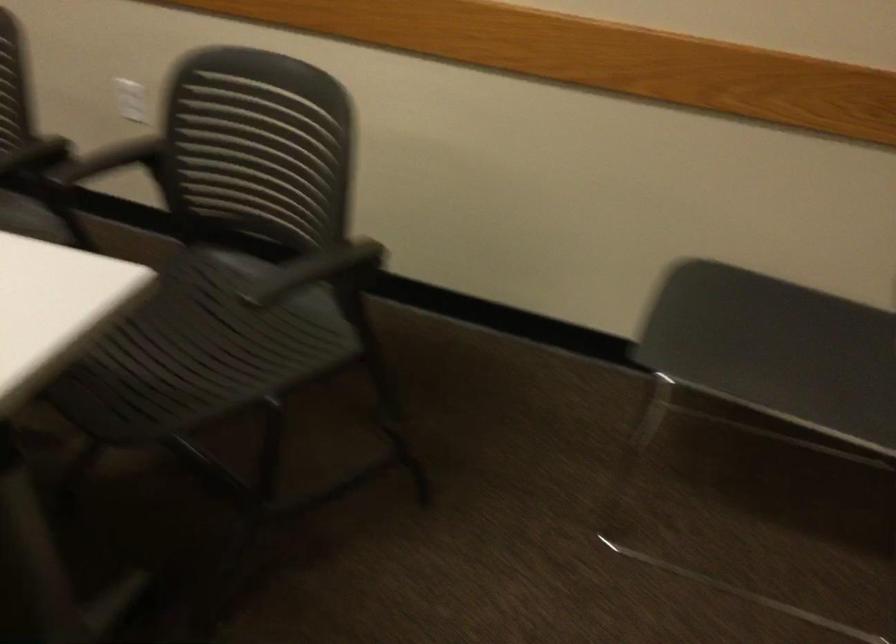
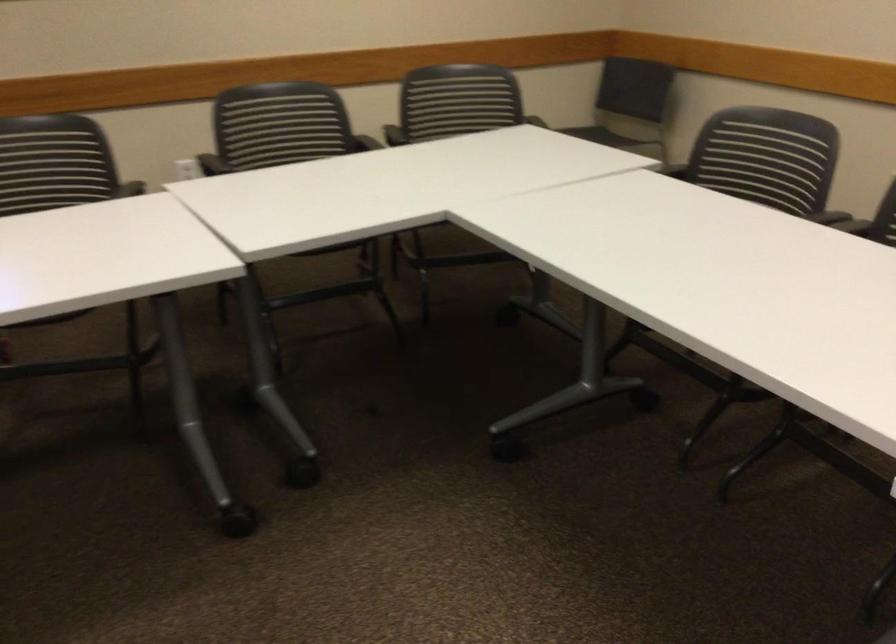
Question: I am providing you with two images of the same scene from different viewpoints. Which of the following objects are not visible in image2?

Choices:
 (A) chair sitting surface
 (B) black chair armrest
 (C) black chair sitting surface
 (D) beige mug

Answer: (A)